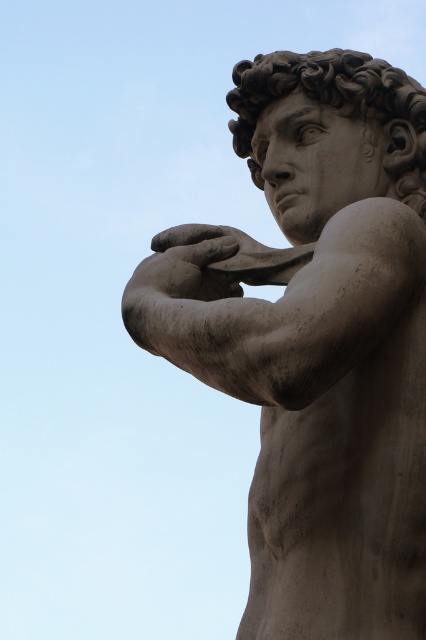
You are an art conservator examining the statue and its head. Which part is closer to you, the stone statue at center or the smooth stone head at center?

The stone statue at center is closer to you than the smooth stone head at center.

You are an art restorer working on the stone statue at center and the matte stone hand at center. You need to determine which object requires a taller support stand. Which object should you choose the taller stand for?

The stone statue at center is taller than the matte stone hand at center, so you should choose the taller support stand for the stone statue at center.